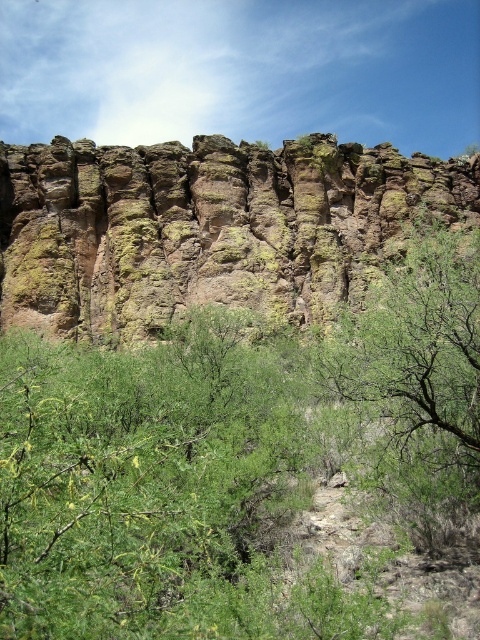
Which is more to the left, rusty rock cliff at center or green leafy tree at center?

rusty rock cliff at center

Which of these two, rusty rock cliff at center or green leafy tree at center, stands taller?

Standing taller between the two is rusty rock cliff at center.

Locate an element on the screen. The image size is (480, 640). rusty rock cliff at center is located at coordinates (205, 227).